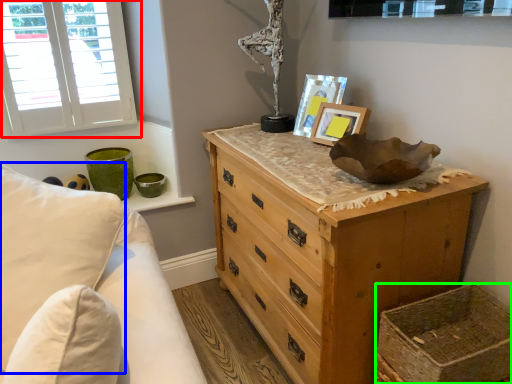
Question: Estimate the real-world distances between objects in this image. Which object is farther from window (highlighted by a red box), pillow (highlighted by a blue box) or basket (highlighted by a green box)?

Choices:
 (A) pillow
 (B) basket

Answer: (B)